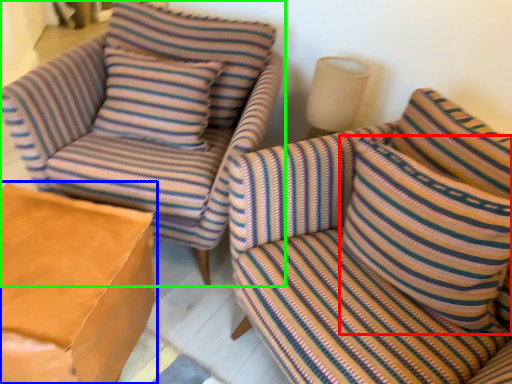
Question: Considering the real-world distances, which object is farthest from pillow (highlighted by a red box)? table (highlighted by a blue box) or chair (highlighted by a green box)?

Choices:
 (A) table
 (B) chair

Answer: (A)